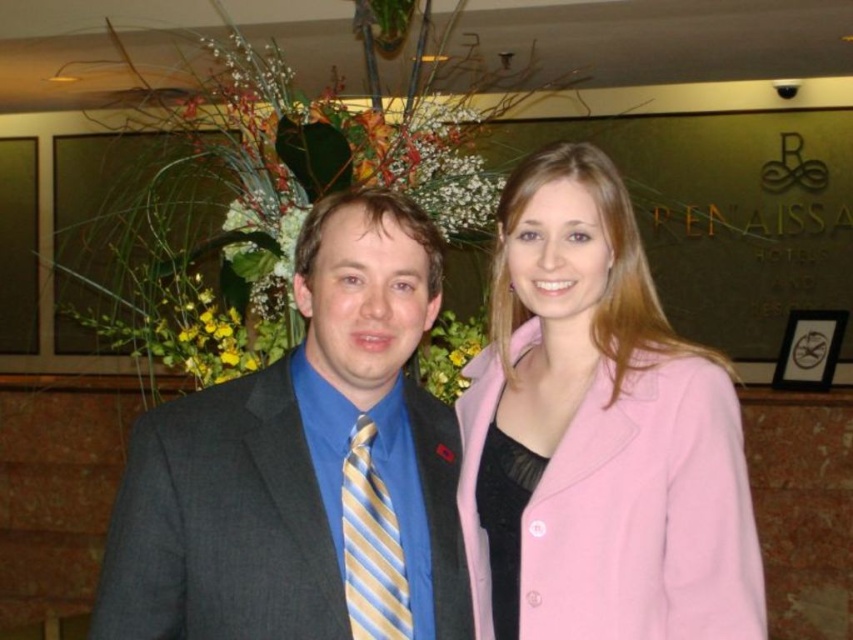
Does pink woolen coat at center appear over matte gray suit at center?

Indeed, pink woolen coat at center is positioned over matte gray suit at center.

Is pink woolen coat at center to the left of matte gray suit at center from the viewer's perspective?

No, pink woolen coat at center is not to the left of matte gray suit at center.

Is point (677, 524) more distant than point (204, 492)?

That is True.

I want to click on pink woolen coat at center, so click(x=598, y=435).

Who is higher up, matte gray suit at center or black satin dress at center?

matte gray suit at center

Find the location of a particular element. This screenshot has width=853, height=640. matte gray suit at center is located at coordinates (297, 458).

Which of these two, pink woolen coat at center or yellow striped tie at center, stands taller?

pink woolen coat at center is taller.

Based on the photo, does pink woolen coat at center have a larger size compared to yellow striped tie at center?

Yes, pink woolen coat at center is bigger than yellow striped tie at center.

Is point (515, 625) less distant than point (396, 552)?

That is False.

At what (x,y) coordinates should I click in order to perform the action: click on pink woolen coat at center. Please return your answer as a coordinate pair (x, y). This screenshot has height=640, width=853. Looking at the image, I should click on (598, 435).